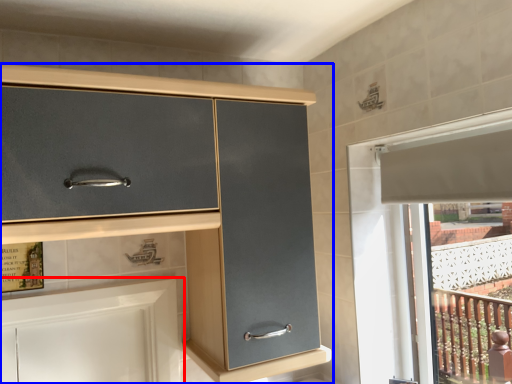
Question: Which object appears farthest to the camera in this image, cabinetry (highlighted by a red box) or cabinetry (highlighted by a blue box)?

Choices:
 (A) cabinetry
 (B) cabinetry

Answer: (A)